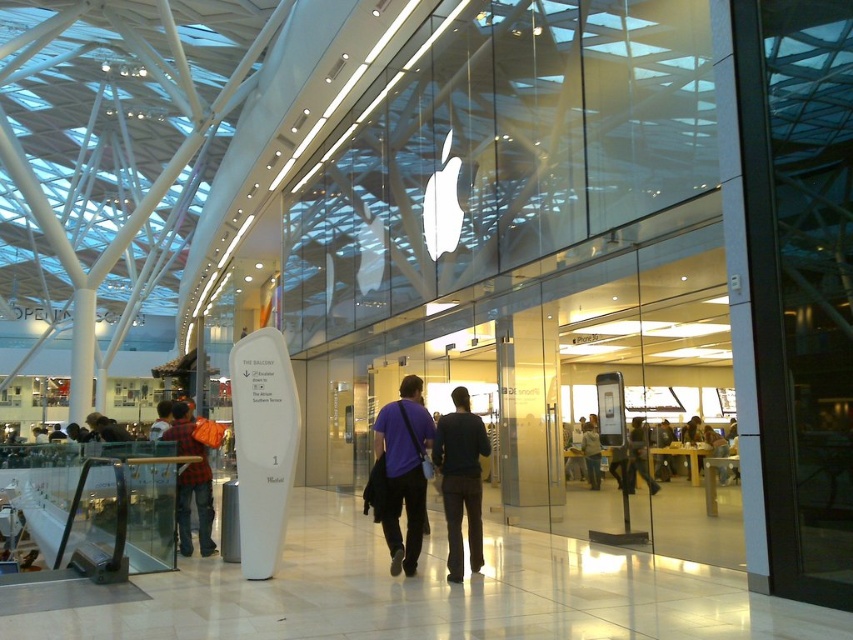
Which is above, matte black phone at center or light brown leather jacket at center?

matte black phone at center

Is matte black phone at center below light brown leather jacket at center?

Incorrect, matte black phone at center is not positioned below light brown leather jacket at center.

What do you see at coordinates (650, 452) in the screenshot? I see `matte black phone at center` at bounding box center [650, 452].

The width and height of the screenshot is (853, 640). Find the location of `matte black phone at center`. matte black phone at center is located at coordinates (x=650, y=452).

Is plaid shirt at left wider than matte black phone at center?

Incorrect, plaid shirt at left's width does not surpass matte black phone at center's.

Between point (189, 493) and point (685, 429), which one is positioned in front?

Point (189, 493) is in front.

Is point (210, 536) positioned before point (670, 470)?

Yes, it is.

Where is `plaid shirt at left`? The width and height of the screenshot is (853, 640). plaid shirt at left is located at coordinates (190, 481).

Can you confirm if black matte pants at center is taller than light brown leather jacket at center?

Indeed, black matte pants at center has a greater height compared to light brown leather jacket at center.

Does black matte pants at center have a lesser height compared to light brown leather jacket at center?

In fact, black matte pants at center may be taller than light brown leather jacket at center.

Is point (473, 419) positioned behind point (590, 442)?

No.

Find the location of a particular element. black matte pants at center is located at coordinates (460, 480).